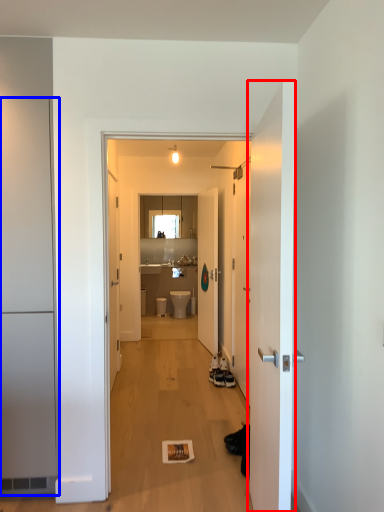
Question: Among these objects, which one is farthest to the camera, door (highlighted by a red box) or door (highlighted by a blue box)?

Choices:
 (A) door
 (B) door

Answer: (B)